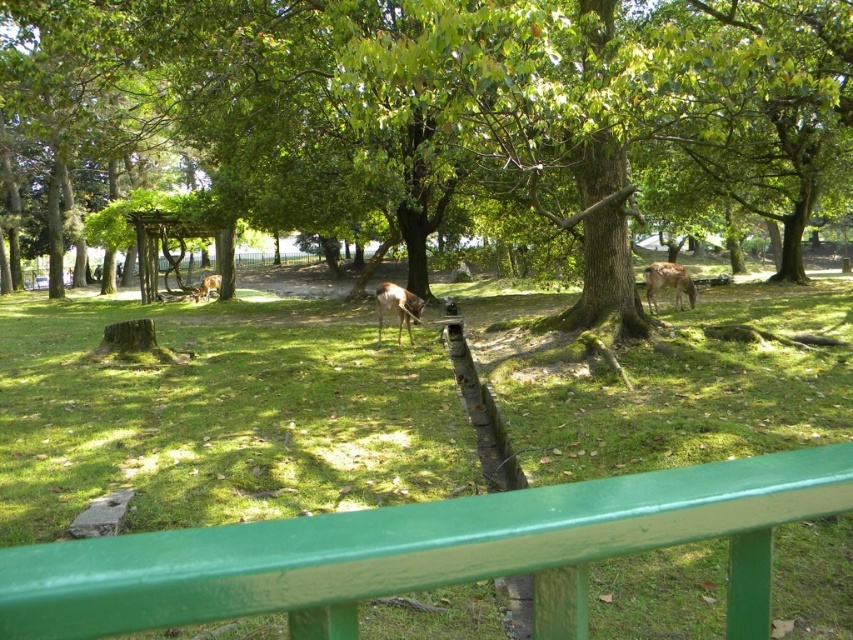
Does green leafy tree at center have a greater height compared to green painted wood rail at lower center?

Correct, green leafy tree at center is much taller as green painted wood rail at lower center.

Can you confirm if green leafy tree at center is positioned to the right of green painted wood rail at lower center?

Incorrect, green leafy tree at center is not on the right side of green painted wood rail at lower center.

Between point (384, 140) and point (25, 632), which one is positioned in front?

Point (25, 632)

Identify the location of green leafy tree at center. (448, 106).

Can you confirm if brown furry deer at center-right is positioned below brown matte deer at center?

Indeed, brown furry deer at center-right is positioned under brown matte deer at center.

Does point (688, 275) come in front of point (198, 291)?

Yes, point (688, 275) is closer to viewer.

Does point (643, 282) come farther from viewer compared to point (209, 288)?

No, it is not.

Find the location of a particular element. This screenshot has width=853, height=640. brown furry deer at center-right is located at coordinates (666, 284).

Which is more to the left, brown matte/deer at center or brown matte deer at center?

brown matte deer at center

Is point (398, 292) farther from camera compared to point (202, 285)?

No, (398, 292) is in front of (202, 285).

Does point (387, 294) come closer to viewer compared to point (204, 284)?

That is True.

Where is `brown matte/deer at center`? The height and width of the screenshot is (640, 853). brown matte/deer at center is located at coordinates (397, 307).